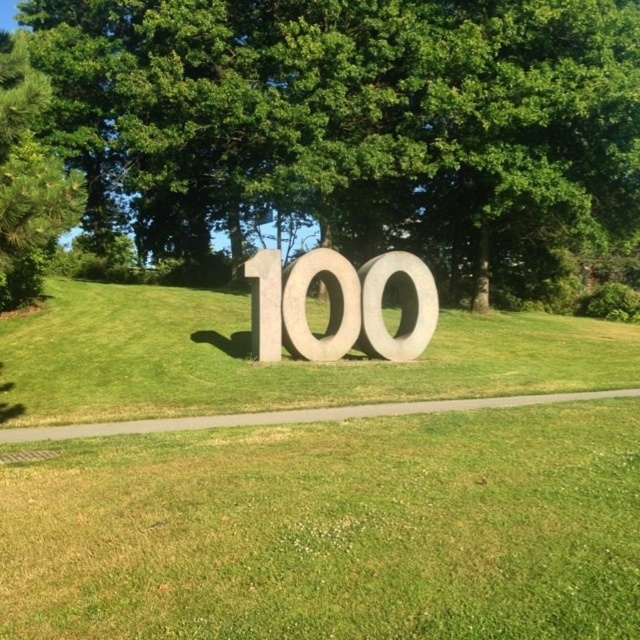
In the scene shown: Does green pine at left have a smaller size compared to metallic gray number at center?

No, green pine at left is not smaller than metallic gray number at center.

Can you confirm if green pine at left is bigger than metallic gray number at center?

Indeed, green pine at left has a larger size compared to metallic gray number at center.

The image size is (640, 640). In order to click on green pine at left in this screenshot , I will do `click(28, 179)`.

The image size is (640, 640). In order to click on green pine at left in this screenshot , I will do `click(28, 179)`.

Can you confirm if gray stone letter at center is thinner than metallic gray number at center?

Incorrect, gray stone letter at center's width is not less than metallic gray number at center's.

This screenshot has width=640, height=640. I want to click on gray stone letter at center, so click(x=328, y=305).

Is sanded concrete number at center further to the viewer compared to green pine at left?

Yes, sanded concrete number at center is behind green pine at left.

Looking at this image, can you confirm if sanded concrete number at center is shorter than green pine at left?

Correct, sanded concrete number at center is not as tall as green pine at left.

This screenshot has width=640, height=640. In order to click on sanded concrete number at center in this screenshot , I will do `click(339, 305)`.